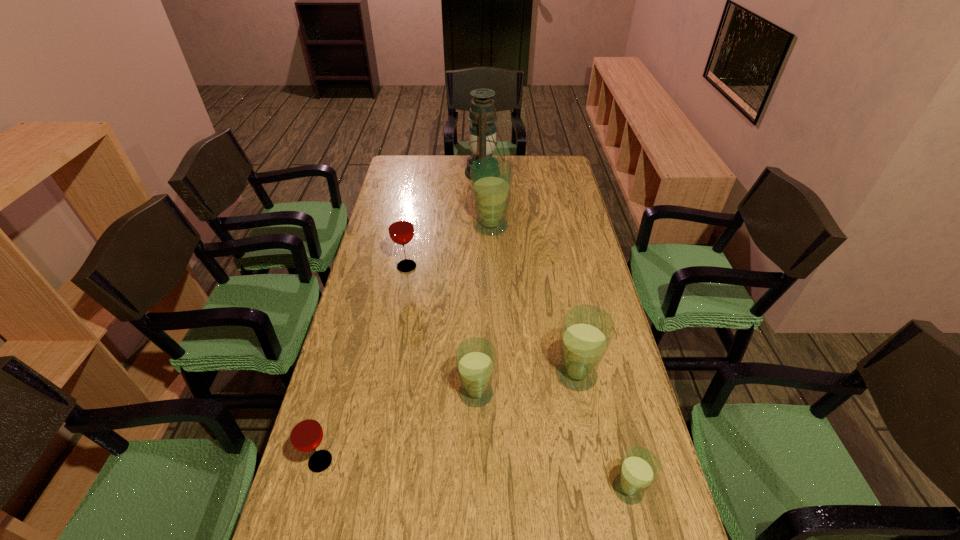
Where is `the farthest object`? Image resolution: width=960 pixels, height=540 pixels. the farthest object is located at coordinates [482, 139].

You are a GUI agent. You are given a task and a screenshot of the screen. Output one action in this format:
    pyautogui.click(x=<x>, y=<y>)
    Task: Click on the oil lamp
    
    Given the screenshot: What is the action you would take?
    pyautogui.click(x=482, y=139)

Identify the location of the tallest glass. click(x=491, y=177).

Find the location of `the biggest blue glass`. the biggest blue glass is located at coordinates pyautogui.click(x=491, y=177).

Where is `the sixth object from right to left`? The image size is (960, 540). the sixth object from right to left is located at coordinates (401, 230).

This screenshot has height=540, width=960. I want to click on the fifth glass from right to left, so click(x=401, y=230).

The height and width of the screenshot is (540, 960). What are the coordinates of `the third smallest blue glass` in the screenshot? It's located at (587, 330).

Identify the location of the smaller red glass. (305, 432).

The height and width of the screenshot is (540, 960). Find the location of `the leftmost glass`. the leftmost glass is located at coordinates (305, 432).

At what (x,y) coordinates should I click in order to perform the action: click on the second smallest blue glass. Please return your answer as a coordinate pair (x, y). Looking at the image, I should click on (475, 357).